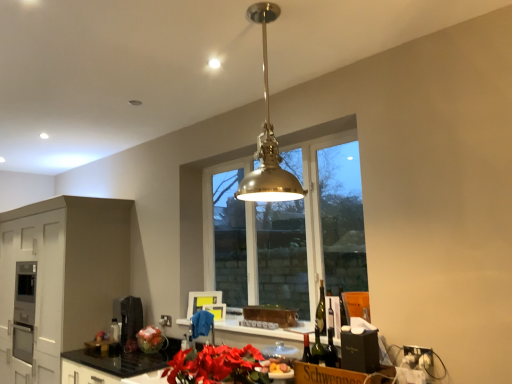
In order to click on black granite countertop at lower center, placed as the first countertop when sorted from right to left in this screenshot , I will do `click(115, 363)`.

What do you see at coordinates (292, 231) in the screenshot? I see `clear glass window at center` at bounding box center [292, 231].

In order to face matte black coffee machine at lower left, which appears as the second appliance when viewed from the front, should I rotate leftwards or rightwards?

A 16.245 degree turn to the left will do.

The image size is (512, 384). Describe the element at coordinates (268, 136) in the screenshot. I see `brass/polished metal pendant light at center` at that location.

This screenshot has height=384, width=512. Describe the element at coordinates (125, 360) in the screenshot. I see `black granite countertop at lower center, arranged as the 1th countertop when viewed from the left` at that location.

Locate an element on the screen. This screenshot has width=512, height=384. metallic silver toaster at center, positioned as the 2th appliance in left-to-right order is located at coordinates (216, 311).

The image size is (512, 384). In order to click on brown cardboard box at lower right in this screenshot , I will do [x=339, y=375].

You are a GUI agent. You are given a task and a screenshot of the screen. Output one action in this format:
    pyautogui.click(x=<x>, y=<y>)
    Task: Click on the black granite countertop at lower center, placed as the first countertop when sorted from right to left
    
    Given the screenshot: What is the action you would take?
    pyautogui.click(x=115, y=363)

Is brown cardboard box at lower right far away from brass/polished metal pendant light at center?

They are positioned close to each other.

From the image's perspective, is brown cardboard box at lower right above or below brass/polished metal pendant light at center?

brown cardboard box at lower right is situated lower than brass/polished metal pendant light at center in the image.

In terms of size, does brown cardboard box at lower right appear bigger or smaller than brass/polished metal pendant light at center?

Clearly, brown cardboard box at lower right is smaller in size than brass/polished metal pendant light at center.

Considering the positions of points (276, 186) and (101, 369), is point (276, 186) closer to camera compared to point (101, 369)?

Yes, point (276, 186) is in front of point (101, 369).

At what (x,y) coordinates should I click in order to perform the action: click on the 2nd countertop below the brass/polished metal pendant light at center (from the image's perspective). Please return your answer as a coordinate pair (x, y). The height and width of the screenshot is (384, 512). Looking at the image, I should click on (125, 360).

From the image's perspective, is brass/polished metal pendant light at center above or below black granite countertop at lower center, which is the second countertop in right-to-left order?

Based on their image positions, brass/polished metal pendant light at center is located above black granite countertop at lower center, which is the second countertop in right-to-left order.

Relative to white matte cabinetry at lower left, is matte metallic vase at lower center in front or behind?

matte metallic vase at lower center is behind white matte cabinetry at lower left.

Identify the location of flower below the white matte cabinetry at lower left (from the image's perspective). (150, 338).

Does point (212, 170) appear closer or farther from the camera than point (138, 356)?

Point (212, 170) appears to be farther away from the viewer than point (138, 356).

Which of these two, clear glass window at center or black granite countertop at lower center, arranged as the 1th countertop when viewed from the left, is bigger?

black granite countertop at lower center, arranged as the 1th countertop when viewed from the left, is bigger.

From the image's perspective, is clear glass window at center located beneath black granite countertop at lower center, which is the second countertop in right-to-left order?

No, from the image's perspective, clear glass window at center is not below black granite countertop at lower center, which is the second countertop in right-to-left order.

Does clear glass window at center turn towards black granite countertop at lower center, arranged as the 1th countertop when viewed from the left?

No, clear glass window at center is not facing towards black granite countertop at lower center, arranged as the 1th countertop when viewed from the left.

Considering the relative sizes of metallic silver toaster at center, which is counted as the 1th appliance, starting from the front, and clear glass window at center in the image provided, is metallic silver toaster at center, which is counted as the 1th appliance, starting from the front, thinner than clear glass window at center?

Yes.

From the image's perspective, does metallic silver toaster at center, arranged as the second appliance when viewed from the back, appear higher than clear glass window at center?

No, from the image's perspective, metallic silver toaster at center, arranged as the second appliance when viewed from the back, is not over clear glass window at center.

Considering the relative sizes of metallic silver toaster at center, arranged as the second appliance when viewed from the back, and clear glass window at center in the image provided, is metallic silver toaster at center, arranged as the second appliance when viewed from the back, bigger than clear glass window at center?

Incorrect, metallic silver toaster at center, arranged as the second appliance when viewed from the back, is not larger than clear glass window at center.

Does black granite countertop at lower center, which is the second countertop from left to right, have a larger size compared to black granite countertop at lower center, which is the second countertop in right-to-left order?

Correct, black granite countertop at lower center, which is the second countertop from left to right, is larger in size than black granite countertop at lower center, which is the second countertop in right-to-left order.

Could you tell me if black granite countertop at lower center, placed as the first countertop when sorted from right to left, is facing black granite countertop at lower center, which is the second countertop in right-to-left order?

Yes, black granite countertop at lower center, placed as the first countertop when sorted from right to left, is facing black granite countertop at lower center, which is the second countertop in right-to-left order.

From the image's perspective, which is below, black granite countertop at lower center, placed as the first countertop when sorted from right to left, or black granite countertop at lower center, which is the second countertop in right-to-left order?

black granite countertop at lower center, which is the second countertop in right-to-left order, from the image's perspective.

Considering the sizes of objects black granite countertop at lower center, which is the second countertop from left to right, and black granite countertop at lower center, which is the second countertop in right-to-left order, in the image provided, who is taller, black granite countertop at lower center, which is the second countertop from left to right, or black granite countertop at lower center, which is the second countertop in right-to-left order,?

Standing taller between the two is black granite countertop at lower center, which is the second countertop from left to right.

Considering the relative positions of clear glass window at center and metallic silver toaster at center, positioned as the 2th appliance in left-to-right order, in the image provided, is clear glass window at center behind metallic silver toaster at center, positioned as the 2th appliance in left-to-right order,?

No, clear glass window at center is in front of metallic silver toaster at center, positioned as the 2th appliance in left-to-right order.

Locate an element on the screen. window on the right of metallic silver toaster at center, positioned as the 2th appliance in left-to-right order is located at coordinates (292, 231).

Is clear glass window at center oriented towards metallic silver toaster at center, positioned as the first appliance in right-to-left order?

Yes, clear glass window at center is turned towards metallic silver toaster at center, positioned as the first appliance in right-to-left order.

Image resolution: width=512 pixels, height=384 pixels. Find the location of `light fixture in front of the brown cardboard box at lower right`. light fixture in front of the brown cardboard box at lower right is located at coordinates (268, 136).

Where is `the 2nd countertop counting from the left of the brass/polished metal pendant light at center`? This screenshot has width=512, height=384. the 2nd countertop counting from the left of the brass/polished metal pendant light at center is located at coordinates (125, 360).

Considering their positions, is white matte cabinetry at lower left positioned closer to matte black coffee machine at lower left, marked as the 2th appliance in a right-to-left arrangement, than brass/polished metal pendant light at center?

white matte cabinetry at lower left.

Considering their positions, is clear glass window at center positioned further to black granite countertop at lower center, which is the second countertop in right-to-left order, than matte metallic vase at lower center?

clear glass window at center is positioned further to the anchor black granite countertop at lower center, which is the second countertop in right-to-left order.

Based on their spatial positions, is metallic silver toaster at center, arranged as the second appliance when viewed from the back, or brown cardboard box at lower right further from brass/polished metal pendant light at center?

metallic silver toaster at center, arranged as the second appliance when viewed from the back, is further to brass/polished metal pendant light at center.

From the image, which object appears to be nearer to black granite countertop at lower center, which is the second countertop from left to right, metallic silver toaster at center, which is counted as the 1th appliance, starting from the front, or matte metallic vase at lower center?

matte metallic vase at lower center is closer to black granite countertop at lower center, which is the second countertop from left to right.

Which object lies nearer to the anchor point metallic silver toaster at center, positioned as the 2th appliance in left-to-right order, matte black coffee machine at lower left, marked as the 2th appliance in a right-to-left arrangement, or black granite countertop at lower center, which is the second countertop in right-to-left order?

black granite countertop at lower center, which is the second countertop in right-to-left order, is closer to metallic silver toaster at center, positioned as the 2th appliance in left-to-right order.

From the image, which object appears to be nearer to brass/polished metal pendant light at center, matte black coffee machine at lower left, marked as the 2th appliance in a right-to-left arrangement, or white matte cabinetry at lower left?

matte black coffee machine at lower left, marked as the 2th appliance in a right-to-left arrangement, is positioned closer to the anchor brass/polished metal pendant light at center.

Looking at the image, which one is located closer to black granite countertop at lower center, which is the second countertop in right-to-left order, brown cardboard box at lower right or brass/polished metal pendant light at center?

brown cardboard box at lower right lies closer to black granite countertop at lower center, which is the second countertop in right-to-left order, than the other object.

Based on their spatial positions, is black granite countertop at lower center, which is the second countertop in right-to-left order, or matte black coffee machine at lower left, the first appliance viewed from the left, further from metallic silver toaster at center, positioned as the first appliance in right-to-left order?

matte black coffee machine at lower left, the first appliance viewed from the left, lies further to metallic silver toaster at center, positioned as the first appliance in right-to-left order, than the other object.

Locate an element on the screen. This screenshot has height=384, width=512. countertop between brown cardboard box at lower right and metallic silver toaster at center, which is counted as the 1th appliance, starting from the front, along the z-axis is located at coordinates (125, 360).

You are a GUI agent. You are given a task and a screenshot of the screen. Output one action in this format:
    pyautogui.click(x=<x>, y=<y>)
    Task: Click on the countertop between black granite countertop at lower center, placed as the first countertop when sorted from right to left, and white matte cabinetry at lower left, along the z-axis
    
    Given the screenshot: What is the action you would take?
    pyautogui.click(x=125, y=360)

At what (x,y) coordinates should I click in order to perform the action: click on appliance between black granite countertop at lower center, which is the second countertop in right-to-left order, and matte metallic vase at lower center from front to back. Please return your answer as a coordinate pair (x, y). The image size is (512, 384). Looking at the image, I should click on (216, 311).

The height and width of the screenshot is (384, 512). In order to click on appliance between white matte cabinetry at lower left and black granite countertop at lower center, which is the second countertop in right-to-left order, in the horizontal direction in this screenshot , I will do `click(131, 322)`.